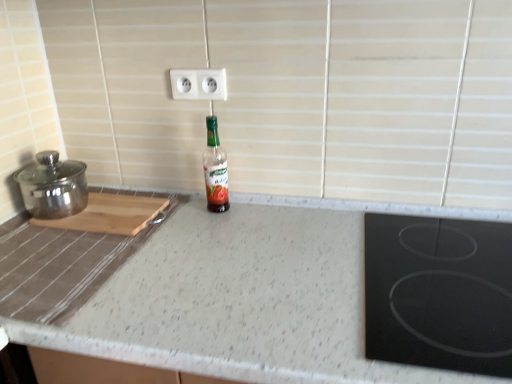
Where is `vacant space in front of green glass bottle at center`? The width and height of the screenshot is (512, 384). vacant space in front of green glass bottle at center is located at coordinates (211, 236).